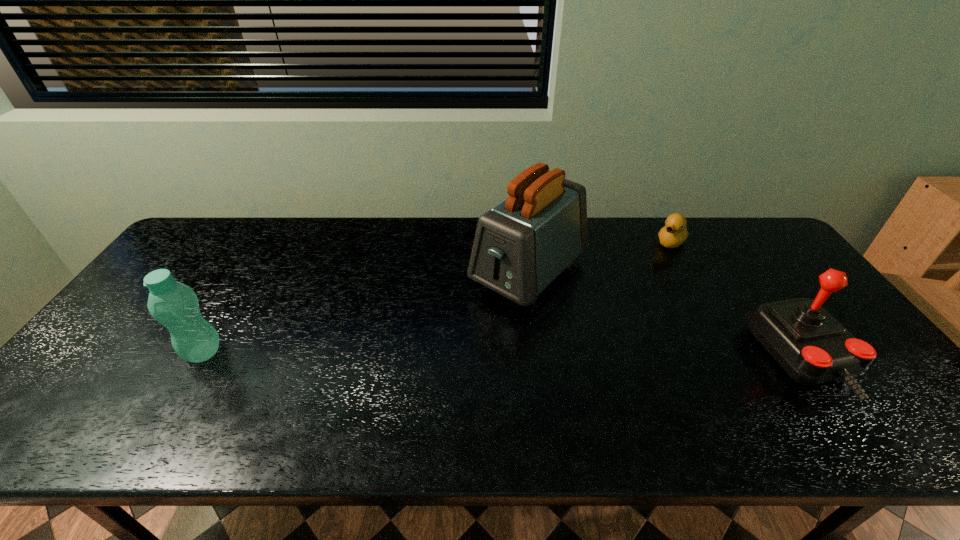
Image resolution: width=960 pixels, height=540 pixels. Identify the location of blank space at the near edge. coord(556,377).

The image size is (960, 540). In the image, there is a desktop. What are the coordinates of `vacant space at the far left corner` in the screenshot? It's located at (194, 232).

The height and width of the screenshot is (540, 960). I want to click on free point between the leftmost object and the joystick, so click(x=503, y=355).

Identify the location of unoccupied area between the shortest object and the rightmost object. point(736,300).

Image resolution: width=960 pixels, height=540 pixels. I want to click on vacant space that is in between the duckling and the rightmost object, so click(736, 300).

I want to click on vacant point located between the second object from right to left and the leftmost object, so click(x=438, y=297).

I want to click on vacant point located between the duckling and the rightmost object, so click(736, 300).

Find the location of a particular element. The height and width of the screenshot is (540, 960). unoccupied position between the bottle and the toaster is located at coordinates (366, 313).

Locate an element on the screen. free spot between the third object from left to right and the toaster is located at coordinates (600, 257).

What are the coordinates of `unoccupied position between the rightmost object and the toaster` in the screenshot? It's located at (665, 316).